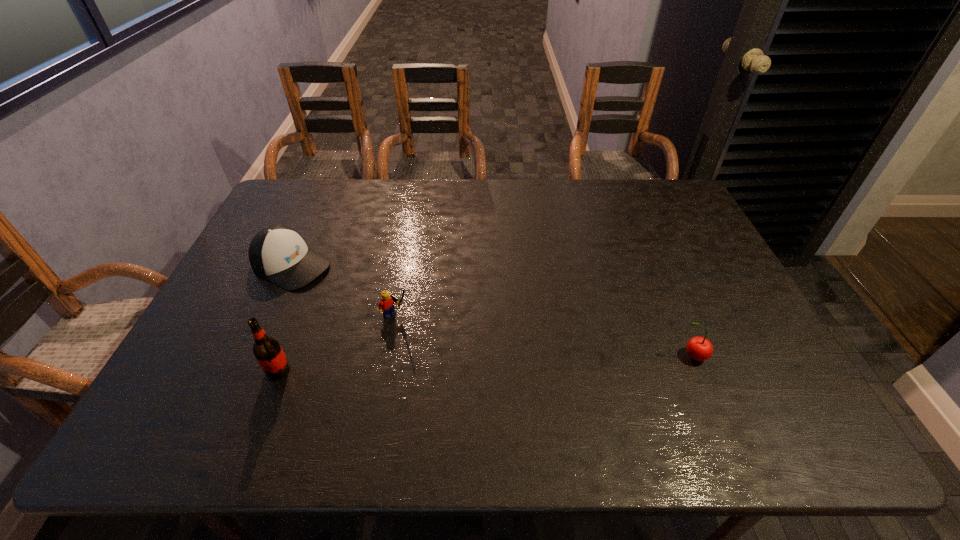
The image size is (960, 540). I want to click on vacant area situated 0.090m on the front-facing side of the third object from left to right, so click(x=428, y=339).

The width and height of the screenshot is (960, 540). Find the location of `vacant space located on the front-facing side of the third object from left to right`. vacant space located on the front-facing side of the third object from left to right is located at coordinates (492, 392).

Locate an element on the screen. This screenshot has width=960, height=540. vacant space located 0.160m on the front-facing side of the third object from left to right is located at coordinates (447, 354).

This screenshot has width=960, height=540. I want to click on root beer present at the near edge, so click(267, 350).

Find the location of a particular element. Image resolution: width=960 pixels, height=540 pixels. cherry that is at the near edge is located at coordinates (698, 348).

You are a GUI agent. You are given a task and a screenshot of the screen. Output one action in this format:
    pyautogui.click(x=<x>, y=<y>)
    Task: Click on the object located at the left edge
    The height and width of the screenshot is (540, 960).
    Given the screenshot: What is the action you would take?
    pyautogui.click(x=278, y=253)

This screenshot has width=960, height=540. In order to click on vacant space at the far edge of the desktop in this screenshot , I will do `click(388, 207)`.

At what (x,y) coordinates should I click in order to perform the action: click on free region at the near edge of the desktop. Please return your answer as a coordinate pair (x, y). Looking at the image, I should click on (629, 395).

You are a GUI agent. You are given a task and a screenshot of the screen. Output one action in this format:
    pyautogui.click(x=<x>, y=<y>)
    Task: Click on the vacant space at the right edge of the desktop
    
    Given the screenshot: What is the action you would take?
    pyautogui.click(x=712, y=360)

Identify the location of vacant space that's between the cap and the tallest object. (285, 318).